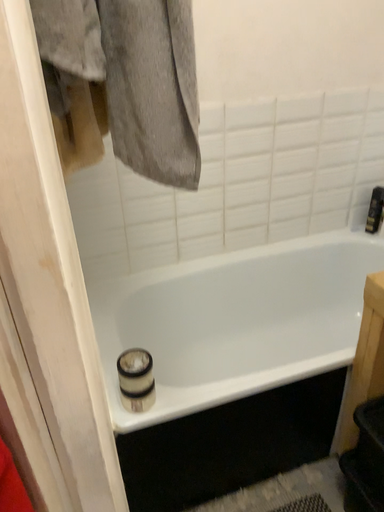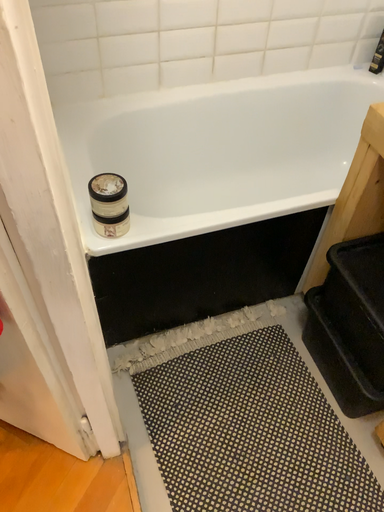
Question: Which way did the camera rotate in the video?

Choices:
 (A) rotated upward
 (B) rotated downward

Answer: (B)